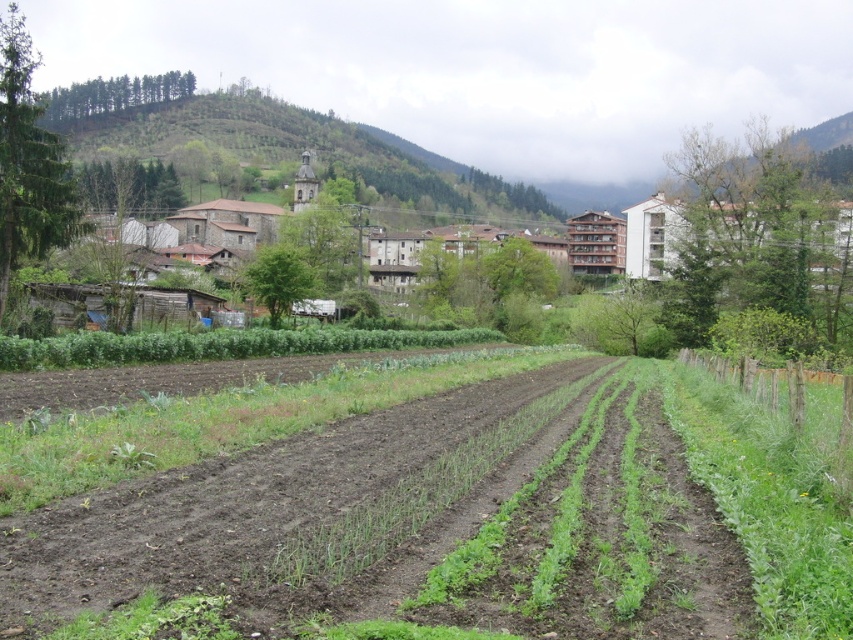
Question: Considering the relative positions of brown stone buildings at center and green forested hillside at upper center in the image provided, where is brown stone buildings at center located with respect to green forested hillside at upper center?

Choices:
 (A) below
 (B) above

Answer: (A)

Question: Can you confirm if brown stone buildings at center is positioned above green forested hillside at upper center?

Choices:
 (A) yes
 (B) no

Answer: (B)

Question: Which of the following is the farthest from the observer?

Choices:
 (A) green forested hillside at upper center
 (B) brown stone buildings at center

Answer: (B)

Question: Which point is farther to the camera?

Choices:
 (A) (198, 108)
 (B) (682, 237)

Answer: (A)

Question: Which point is farther to the camera?

Choices:
 (A) coord(125,125)
 (B) coord(822,196)

Answer: (A)

Question: Considering the relative positions of brown stone buildings at center and green forested hillside at upper center in the image provided, where is brown stone buildings at center located with respect to green forested hillside at upper center?

Choices:
 (A) left
 (B) right

Answer: (B)